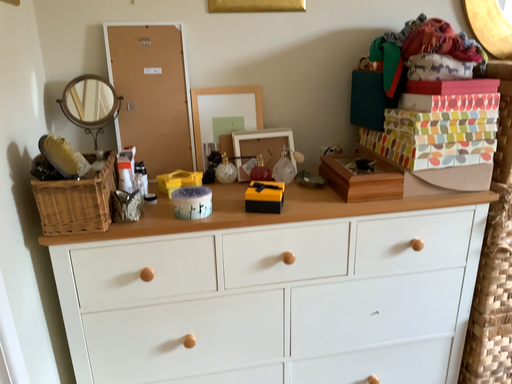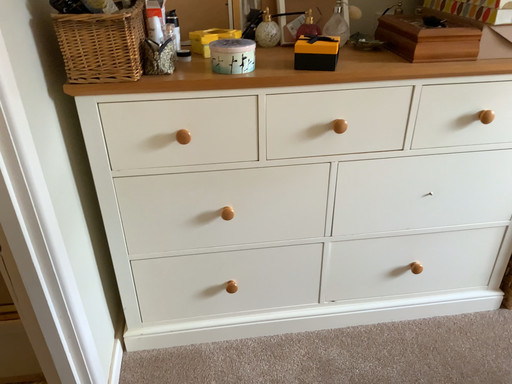
Question: How did the camera likely rotate when shooting the video?

Choices:
 (A) rotated downward
 (B) rotated upward

Answer: (A)